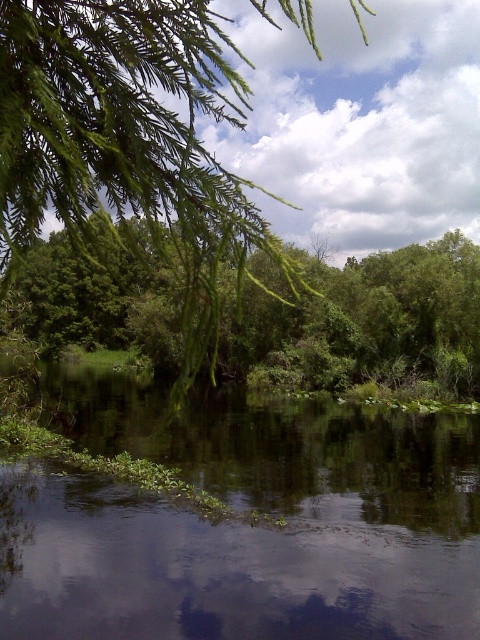
You are standing at the center of the image. Which direction should you look to see the green leafy branch at upper left?

You should look to the upper left to see the green leafy branch at upper left, as it is located at point (129, 144).

Based on the scene description, where would you expect to find the point labeled as point (244, 524)? Please provide your answer using the object labels from the Objects section.

The point (244, 524) corresponds to green leafy vegetation at center.

In the scene shown: You are an environmental scientist studying the ecological balance of this area. You observe the green leafy vegetation at center and the green leafy tree at center. Which of these two has a larger footprint in this scene?

The green leafy tree at center has a larger footprint than the green leafy vegetation at center, as it occupies more space according to the description.